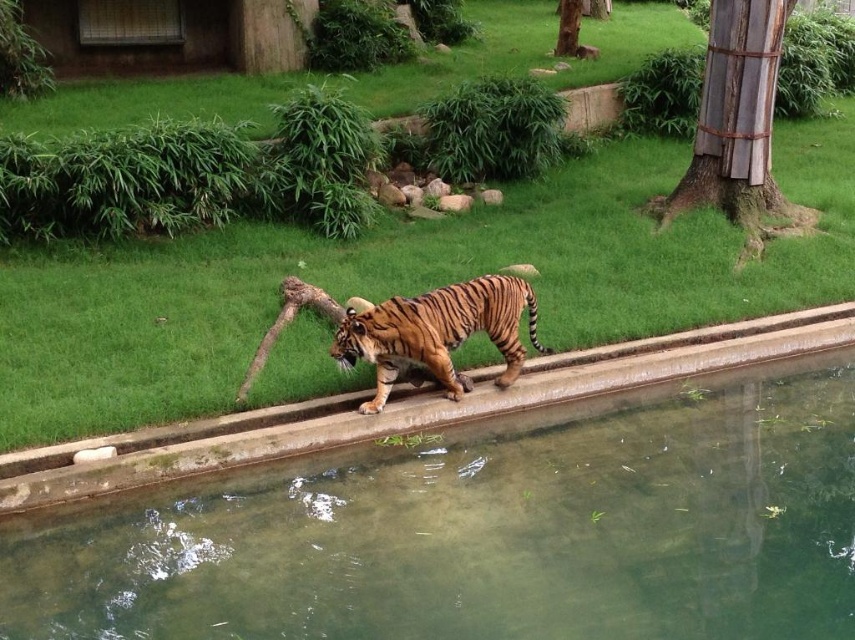
You are a zookeeper who needs to locate a specific point in the tiger enclosure. The point you need to find is point (486, 529). Where is this point located in relation to the tiger and the pool?

The point (486, 529) is on clear glass water at center, so it is located on the clear glass water at the center of the enclosure, which is part of the pool structure. The tiger is walking along the edge of the pool, so the point is near the central area of the pool where the water is clear and glassy.

Consider the image. You are a zookeeper observing the tiger near the pool. You notice a clear glass water at center marked by point (486, 529). Where is this point located relative to the tiger?

The clear glass water at center marked by point (486, 529) is located directly in front of the tiger as it moves from left to right.